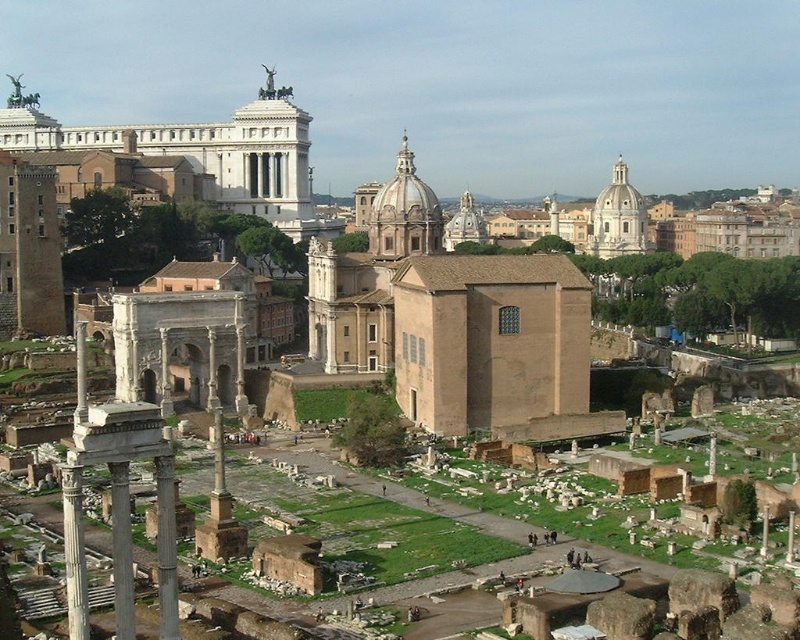
Which is more to the right, smooth stone column at left or white marble pillar at center?

From the viewer's perspective, white marble pillar at center appears more on the right side.

Which is behind, point (81, 368) or point (796, 525)?

The point (81, 368) is more distant.

This screenshot has height=640, width=800. Describe the element at coordinates (80, 372) in the screenshot. I see `smooth stone column at left` at that location.

This screenshot has height=640, width=800. In order to click on smooth stone column at left in this screenshot , I will do `click(80, 372)`.

In the scene shown: Does white marble pillar at lower left have a smaller size compared to smooth stone column at center?

Incorrect, white marble pillar at lower left is not smaller in size than smooth stone column at center.

Can you confirm if white marble pillar at lower left is shorter than smooth stone column at center?

Incorrect, white marble pillar at lower left's height does not fall short of smooth stone column at center's.

Locate an element on the screen. The image size is (800, 640). white marble pillar at lower left is located at coordinates (121, 552).

This screenshot has width=800, height=640. I want to click on white marble pillar at lower left, so click(121, 552).

Does white marble pillar at center have a greater height compared to smooth stone column at center?

Yes, white marble pillar at center is taller than smooth stone column at center.

Can you confirm if white marble pillar at center is positioned below smooth stone column at center?

No.

Does point (792, 525) come in front of point (764, 516)?

Yes, point (792, 525) is closer to viewer.

Locate an element on the screen. This screenshot has height=640, width=800. white marble pillar at center is located at coordinates click(790, 536).